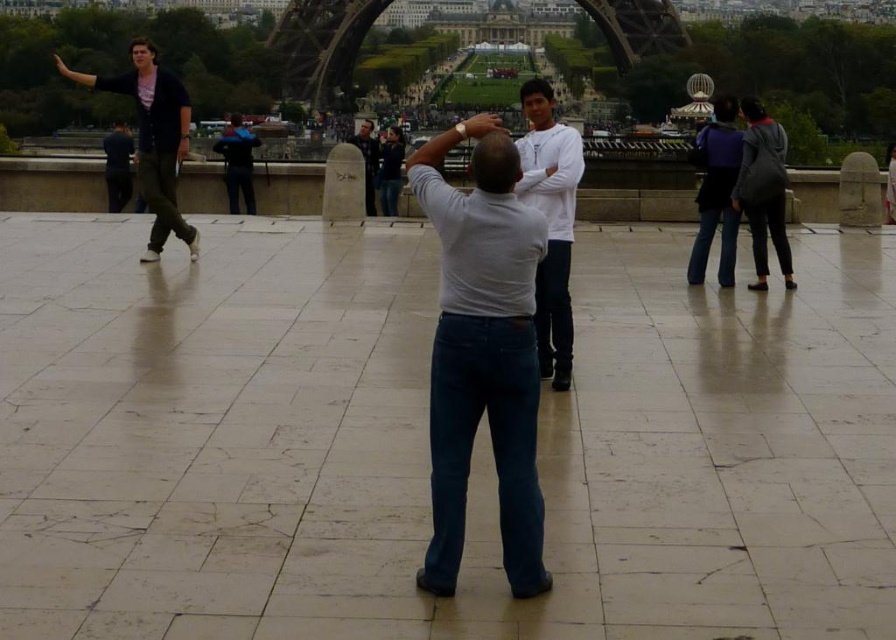
Question: Which point is farther to the camera?

Choices:
 (A) (342, 108)
 (B) (530, 156)
 (C) (367, 177)
 (D) (702, 250)

Answer: (A)

Question: Which object is the closest to the light gray cotton shirt at center?

Choices:
 (A) dark blue jeans at right
 (B) dark gray hoodie at right
 (C) blue denim jeans at center

Answer: (A)

Question: Is light gray cotton shirt at center to the right of dark gray stone statue at center from the viewer's perspective?

Choices:
 (A) no
 (B) yes

Answer: (B)

Question: From the image, what is the correct spatial relationship of white matte shirt at center in relation to dark gray stone statue at center?

Choices:
 (A) right
 (B) left

Answer: (A)

Question: Among these points, which one is farthest from the camera?

Choices:
 (A) (731, 134)
 (B) (748, 212)
 (C) (237, 122)

Answer: (C)

Question: Can you confirm if light gray cotton shirt at center is bigger than dark blue jeans at center?

Choices:
 (A) no
 (B) yes

Answer: (B)